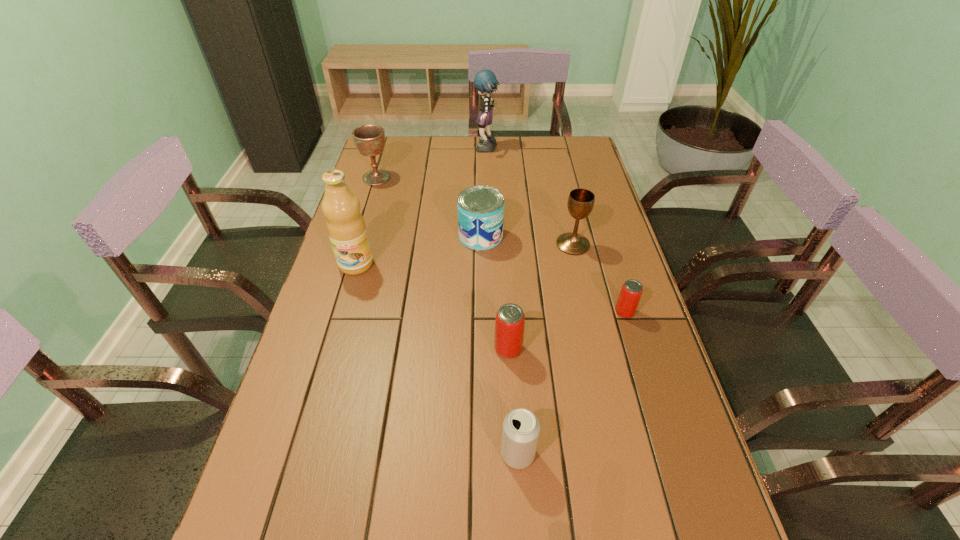
At what (x,y) coordinates should I click in order to perform the action: click on the nearest object. Please return your answer as a coordinate pair (x, y). This screenshot has height=540, width=960. Looking at the image, I should click on (521, 427).

Locate an element on the screen. The image size is (960, 540). white beer can is located at coordinates pyautogui.click(x=521, y=427).

Find the location of `the rightmost beer can`. the rightmost beer can is located at coordinates (630, 294).

Find the location of a particular element. the rightmost object is located at coordinates (630, 294).

Find the location of a particular element. vacant area situated on the front-facing side of the rag doll is located at coordinates (433, 150).

You are a GUI agent. You are given a task and a screenshot of the screen. Output one action in this format:
    pyautogui.click(x=<x>, y=<y>)
    Task: Click on the vacant space located on the front-facing side of the rag doll
    The image size is (960, 540).
    Given the screenshot: What is the action you would take?
    pyautogui.click(x=420, y=150)

What are the coordinates of `vacant space located 0.380m on the front-facing side of the rag doll` in the screenshot? It's located at (377, 150).

You are a GUI agent. You are given a task and a screenshot of the screen. Output one action in this format:
    pyautogui.click(x=<x>, y=<y>)
    Task: Click on the free location located on the label of the olive oil
    The height and width of the screenshot is (540, 960).
    Given the screenshot: What is the action you would take?
    pyautogui.click(x=321, y=388)

Find the location of a particular element. The height and width of the screenshot is (540, 960). vacant area situated on the back of the left chalice is located at coordinates (383, 156).

Identify the location of blank space located on the left of the seventh object from left to right. (480, 245).